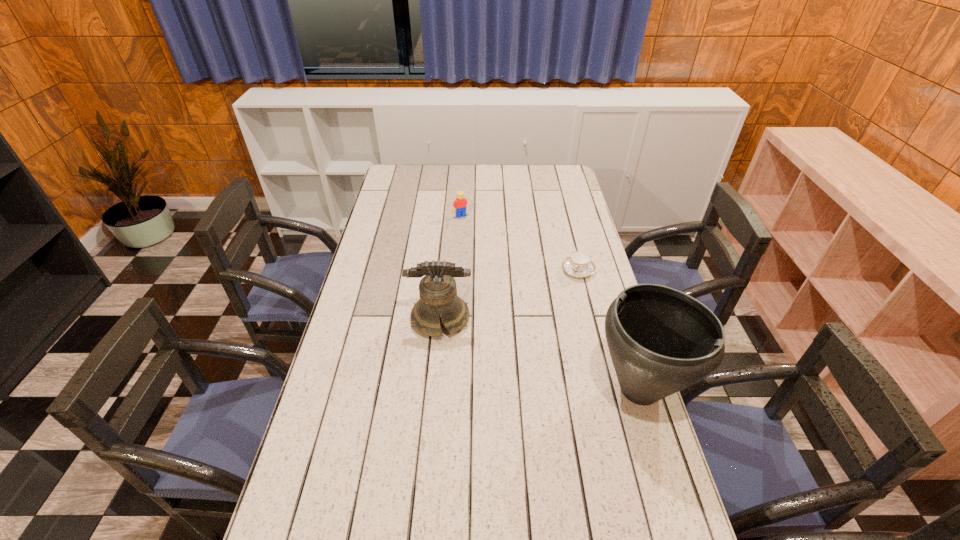
Locate an element on the screen. The width and height of the screenshot is (960, 540). bell is located at coordinates (438, 294).

What are the coordinates of `the second nearest object` in the screenshot? It's located at (438, 294).

Locate an element on the screen. Image resolution: width=960 pixels, height=540 pixels. the nearest object is located at coordinates (661, 340).

What are the coordinates of `the tallest object` in the screenshot? It's located at (661, 340).

At what (x,y) coordinates should I click in order to perform the action: click on the second shortest object. Please return your answer as a coordinate pair (x, y). Looking at the image, I should click on (460, 204).

In order to click on the farthest object in this screenshot , I will do `click(460, 204)`.

The width and height of the screenshot is (960, 540). I want to click on the third nearest object, so click(579, 264).

The image size is (960, 540). I want to click on teacup, so click(x=579, y=264).

The image size is (960, 540). I want to click on vacant space located on the back of the second tallest object, so click(444, 279).

I want to click on free space located 0.220m on the front of the tallest object, so click(x=683, y=525).